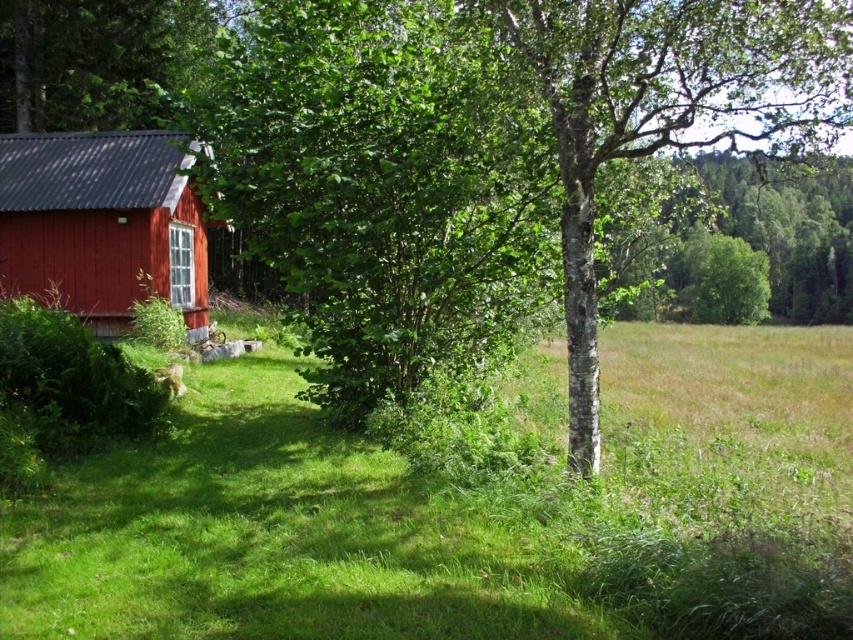
You are a gardener planning to plant a new tree in this area. Considering the positions of the green leafy tree at center and the green leafy tree at upper left, which tree is closer to the ground?

The green leafy tree at center is positioned under the green leafy tree at upper left, so it is closer to the ground.

You are standing in the middle of the field and see the green leafy tree at center and the green leafy tree at upper left. Which tree is closer to your right side?

The green leafy tree at center is positioned on the right side of green leafy tree at upper left, so when standing in the middle of the field, the green leafy tree at center would be closer to your right side.

You are standing in the rural area and want to walk from the green grassy at lower left to the green leafy tree at center. Which direction should you move?

You should move to the right because the green leafy tree at center is to the left of the green grassy at lower left.